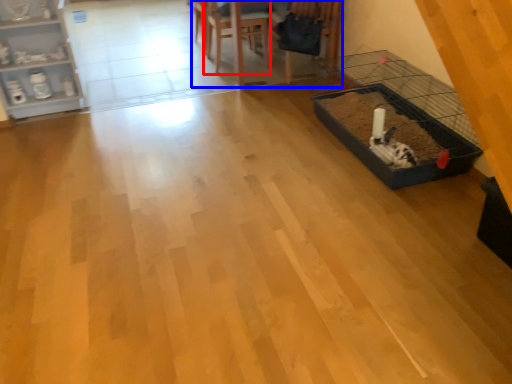
Question: Among these objects, which one is nearest to the camera, armchair (highlighted by a red box) or table (highlighted by a blue box)?

Choices:
 (A) armchair
 (B) table

Answer: (B)